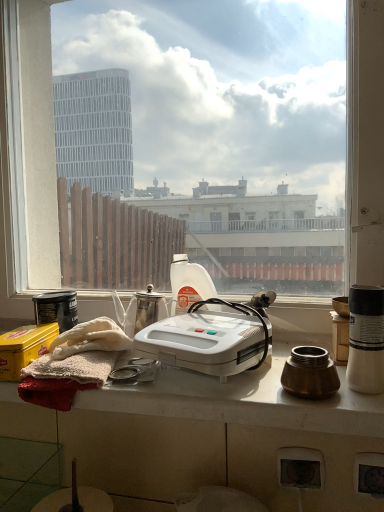
Question: Is yellow matte tin at lower left taller than white plastic waffle maker at center?

Choices:
 (A) no
 (B) yes

Answer: (A)

Question: Would you say yellow matte tin at lower left is outside white plastic waffle maker at center?

Choices:
 (A) yes
 (B) no

Answer: (A)

Question: Is yellow matte tin at lower left smaller than white plastic waffle maker at center?

Choices:
 (A) yes
 (B) no

Answer: (A)

Question: Does yellow matte tin at lower left touch white plastic waffle maker at center?

Choices:
 (A) no
 (B) yes

Answer: (A)

Question: Is yellow matte tin at lower left to the left of white plastic waffle maker at center from the viewer's perspective?

Choices:
 (A) yes
 (B) no

Answer: (A)

Question: Is white glossy coffee cup at right taller or shorter than white glossy table at center?

Choices:
 (A) tall
 (B) short

Answer: (A)

Question: From a real-world perspective, is white glossy coffee cup at right positioned above or below white glossy table at center?

Choices:
 (A) below
 (B) above

Answer: (B)

Question: Based on their positions, is white glossy coffee cup at right located to the left or right of white glossy table at center?

Choices:
 (A) left
 (B) right

Answer: (B)

Question: Is white glossy coffee cup at right bigger or smaller than white glossy table at center?

Choices:
 (A) small
 (B) big

Answer: (A)

Question: In terms of height, does white plastic bottle at center look taller or shorter compared to metallic silver power plugs and sockets at lower center?

Choices:
 (A) tall
 (B) short

Answer: (A)

Question: Considering the relative positions of white plastic bottle at center and metallic silver power plugs and sockets at lower center in the image provided, is white plastic bottle at center to the left or to the right of metallic silver power plugs and sockets at lower center?

Choices:
 (A) left
 (B) right

Answer: (A)

Question: Is white plastic bottle at center in front of or behind metallic silver power plugs and sockets at lower center in the image?

Choices:
 (A) front
 (B) behind

Answer: (B)

Question: Is white plastic bottle at center inside the boundaries of metallic silver power plugs and sockets at lower center, or outside?

Choices:
 (A) inside
 (B) outside

Answer: (B)

Question: Is white plastic waffle maker at center situated inside yellow matte tin at lower left or outside?

Choices:
 (A) outside
 (B) inside

Answer: (A)

Question: Is white plastic waffle maker at center wider or thinner than yellow matte tin at lower left?

Choices:
 (A) wide
 (B) thin

Answer: (A)